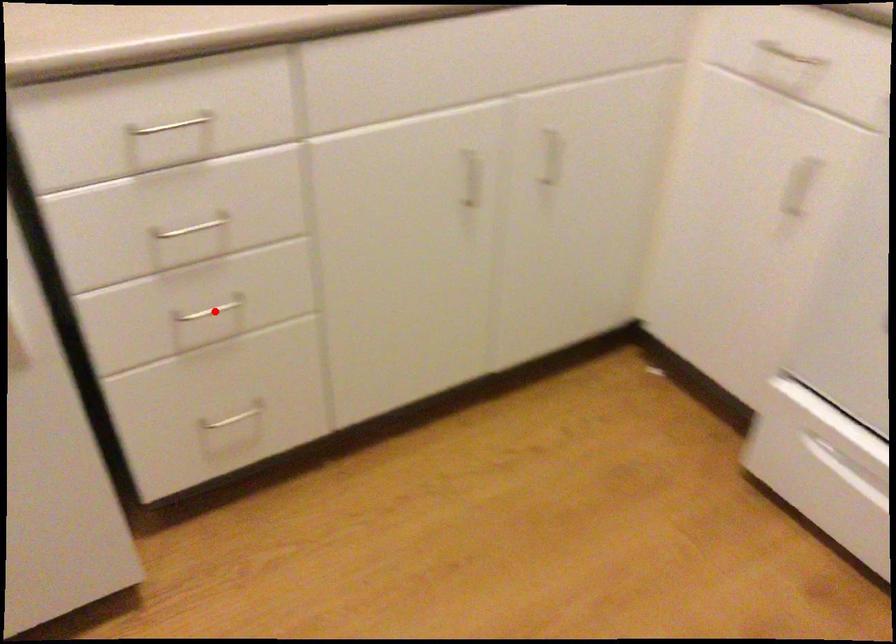
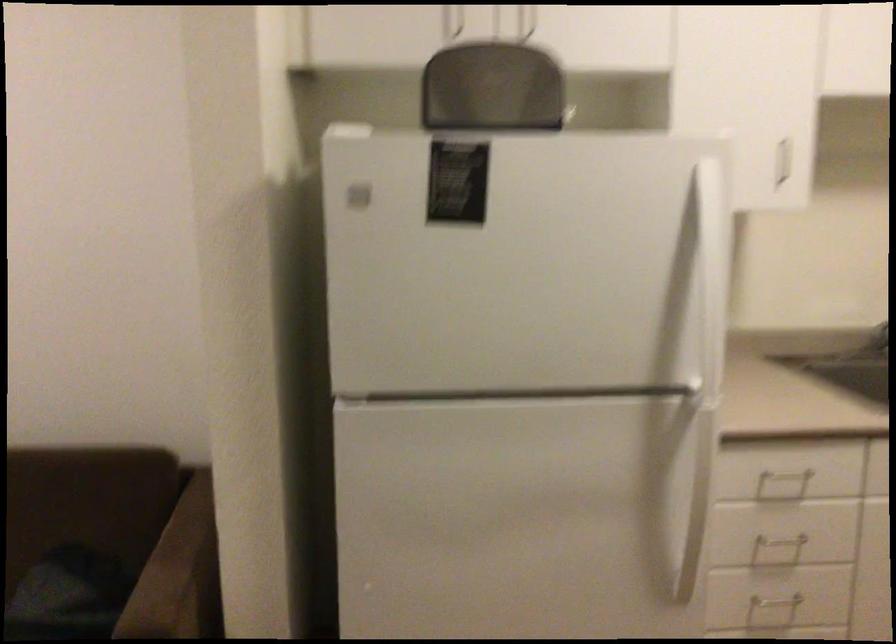
Question: I am providing you with two images of the same scene from different viewpoints. Given a red point in image1, look at the same physical point in image2. Is it:

Choices:
 (A) Closer to the viewpoint
 (B) Farther from the viewpoint

Answer: (B)